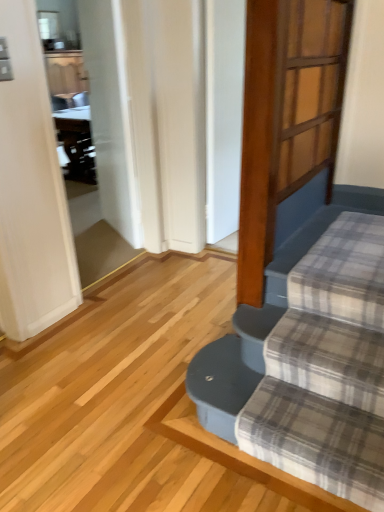
This screenshot has width=384, height=512. Find the location of `vacant space to the left of plaid fabric at lower right`. vacant space to the left of plaid fabric at lower right is located at coordinates pos(134,426).